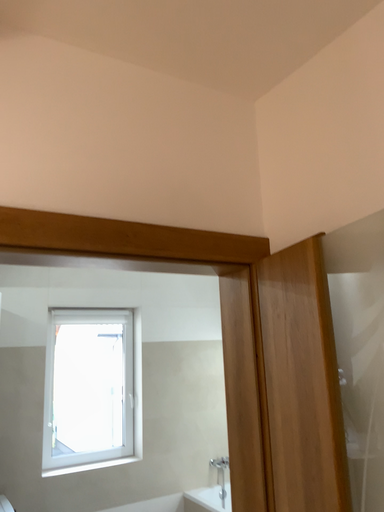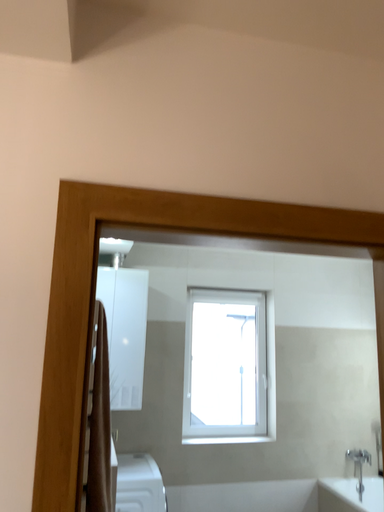
Question: Which way did the camera rotate in the video?

Choices:
 (A) rotated right
 (B) rotated left

Answer: (B)